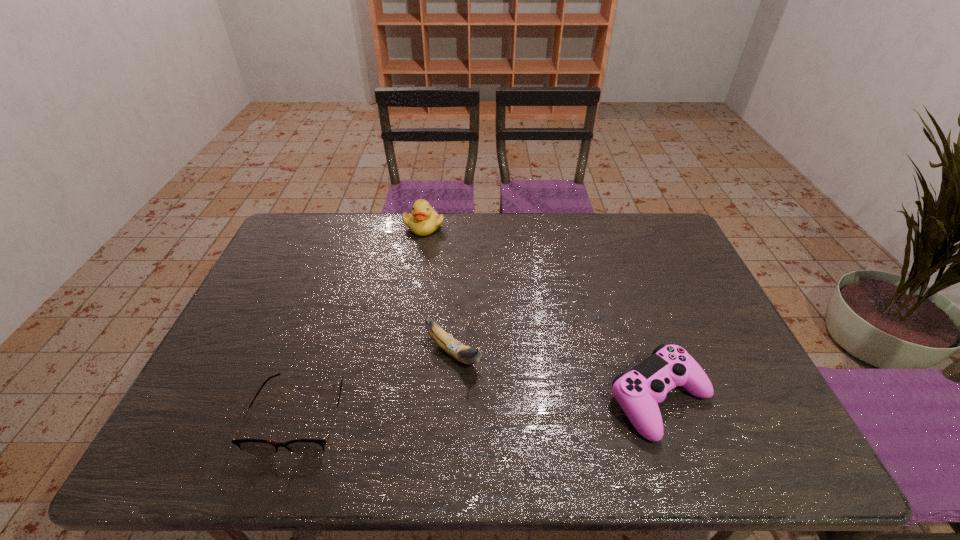
Locate an element on the screen. The width and height of the screenshot is (960, 540). free space between the third tallest object and the duckling is located at coordinates (541, 313).

Identify the location of free space between the leftmost object and the rightmost object. (480, 407).

Locate an element on the screen. This screenshot has height=540, width=960. object identified as the third closest to the control is located at coordinates (424, 220).

At what (x,y) coordinates should I click in order to perform the action: click on object that can be found as the second closest to the spectacles. Please return your answer as a coordinate pair (x, y). Looking at the image, I should click on (424, 220).

This screenshot has width=960, height=540. Identify the location of vacant space that satisfies the following two spatial constraints: 1. on the front side of the duckling; 2. on the right side of the third tallest object. pos(396,400).